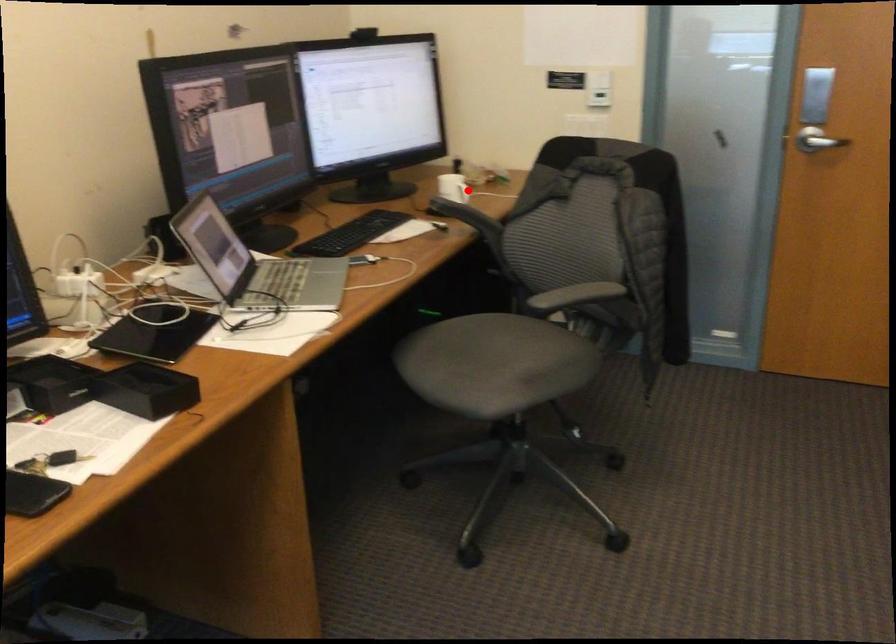
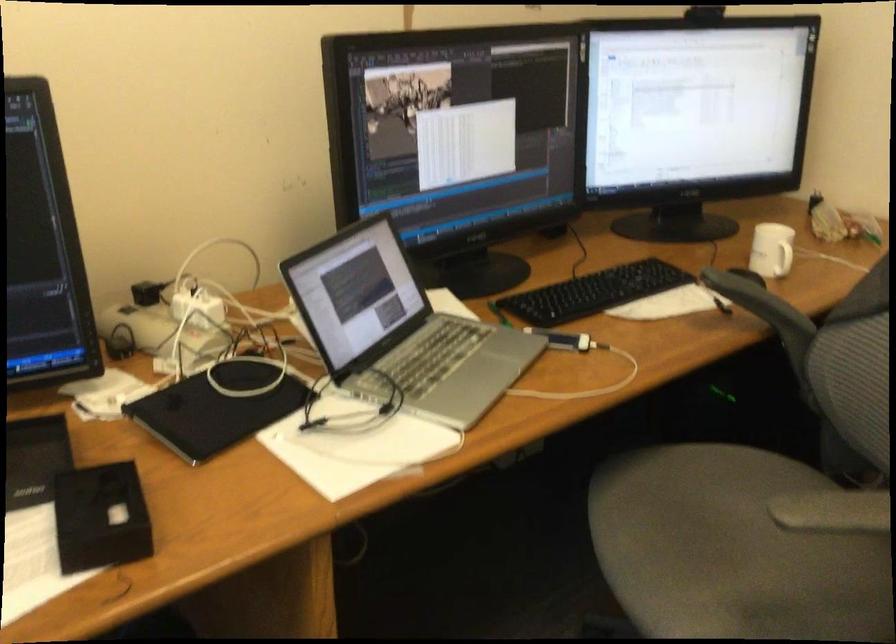
Find the pixel in the second image that matches the highlighted location in the first image.

(782, 259)